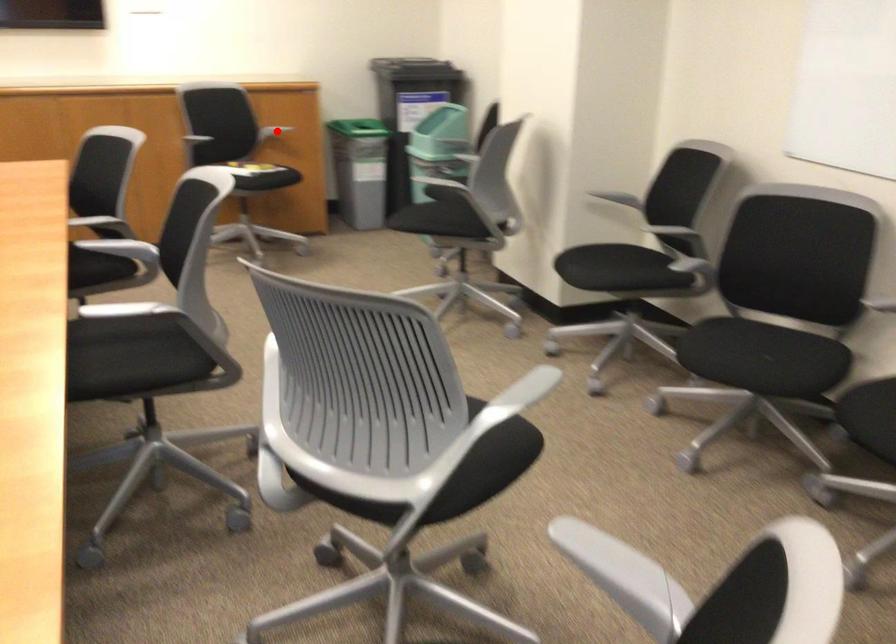
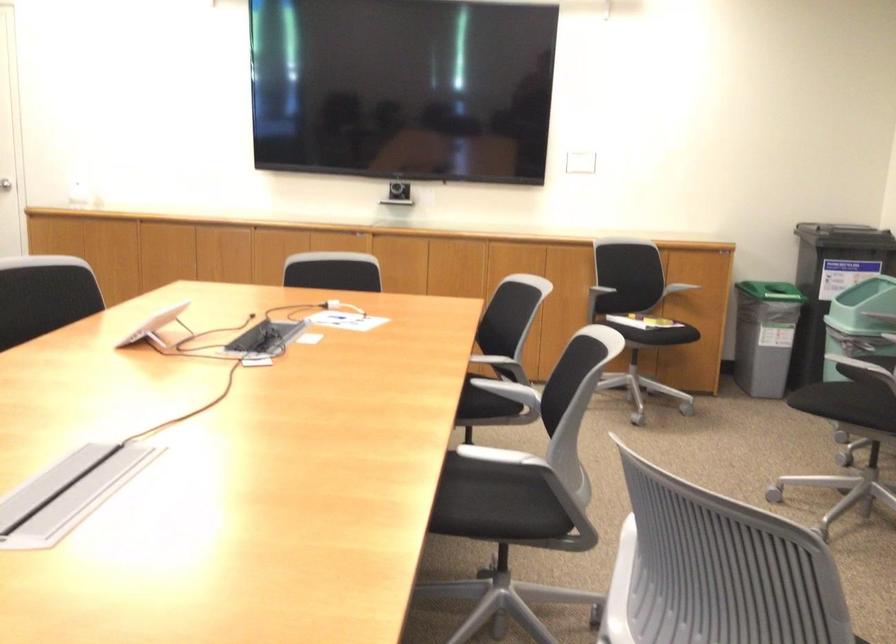
Locate, in the second image, the point that corresponds to the highlighted location in the first image.

(673, 285)